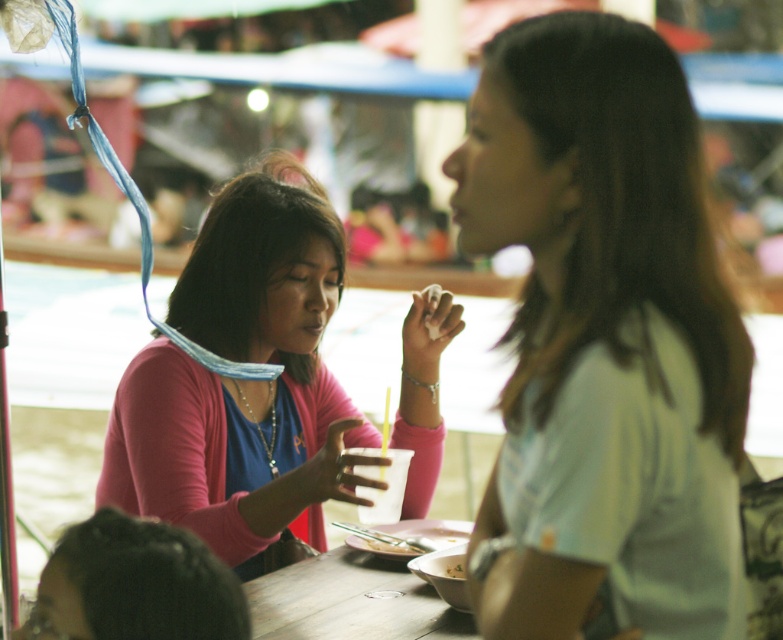
Does light beige shirt at right have a smaller size compared to pink matte sweater at center?

Indeed, light beige shirt at right has a smaller size compared to pink matte sweater at center.

Is the position of light beige shirt at right more distant than that of pink matte sweater at center?

No, it is in front of pink matte sweater at center.

Which is behind, point (518, 611) or point (278, 396)?

The point (278, 396) is behind.

The width and height of the screenshot is (783, 640). I want to click on light beige shirt at right, so click(x=604, y=340).

Does point (302, 340) come behind point (419, 624)?

Yes, it is.

Locate an element on the screen. pink matte sweater at center is located at coordinates (240, 380).

Does light beige shirt at right have a larger size compared to wooden table at center?

Indeed, light beige shirt at right has a larger size compared to wooden table at center.

Who is taller, light beige shirt at right or wooden table at center?

Standing taller between the two is light beige shirt at right.

Find the location of a particular element. The width and height of the screenshot is (783, 640). light beige shirt at right is located at coordinates coord(604,340).